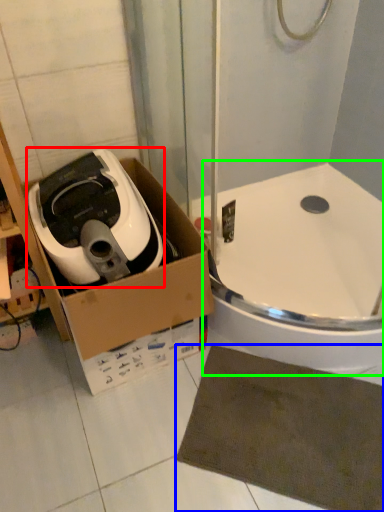
Question: Considering the real-world distances, which object is farthest from home appliance (highlighted by a red box)? bath mat (highlighted by a blue box) or bath (highlighted by a green box)?

Choices:
 (A) bath mat
 (B) bath

Answer: (A)